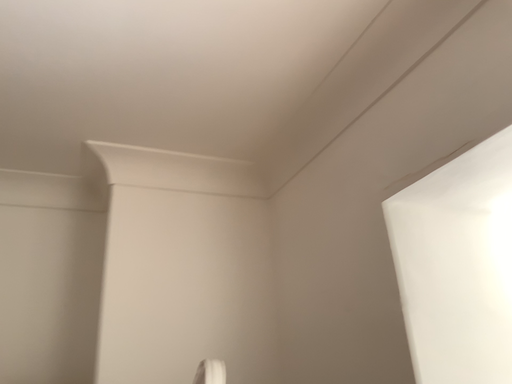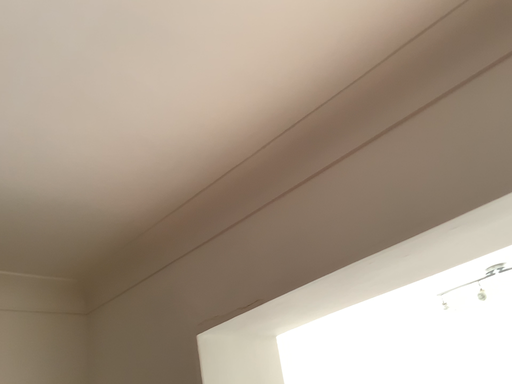
Question: How did the camera likely rotate when shooting the video?

Choices:
 (A) rotated left
 (B) rotated right

Answer: (B)